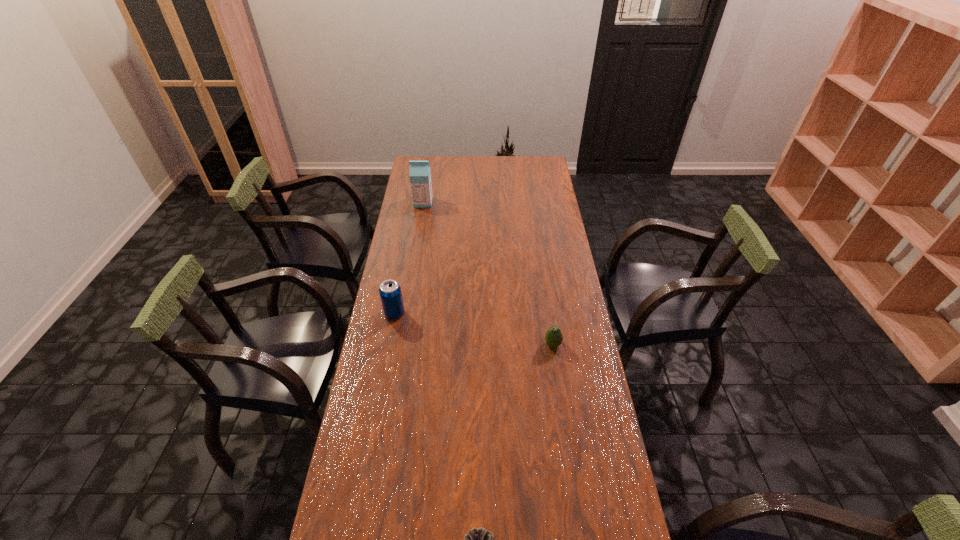
This screenshot has height=540, width=960. In order to click on the tallest object in this screenshot , I will do `click(420, 177)`.

Find the location of `the farthest object`. the farthest object is located at coordinates (420, 177).

Image resolution: width=960 pixels, height=540 pixels. Identify the location of pop soda. (390, 292).

Find the location of a particular element. This screenshot has height=540, width=960. the second tallest object is located at coordinates (390, 292).

The height and width of the screenshot is (540, 960). I want to click on avocado, so click(553, 337).

This screenshot has width=960, height=540. What are the coordinates of `the rightmost object` in the screenshot? It's located at (553, 337).

I want to click on vacant space located on the right of the farthest object, so click(x=487, y=202).

This screenshot has height=540, width=960. In order to click on vacant position located 0.310m on the right of the third shortest object in this screenshot , I will do `click(488, 313)`.

At what (x,y) coordinates should I click in order to perform the action: click on vacant region located on the front of the rightmost object. Please return your answer as a coordinate pair (x, y). This screenshot has height=540, width=960. Looking at the image, I should click on (570, 461).

The height and width of the screenshot is (540, 960). Identify the location of milk carton at the left edge. (420, 177).